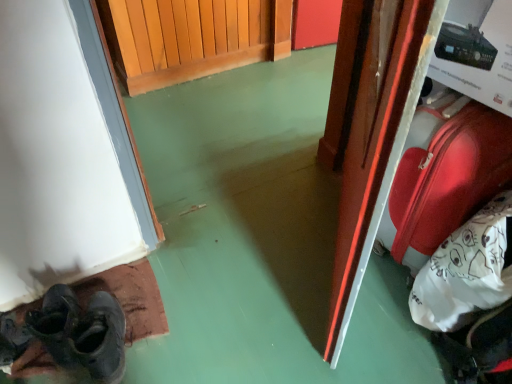
Where is `free space in front of glossy wood door at right`? free space in front of glossy wood door at right is located at coordinates (323, 323).